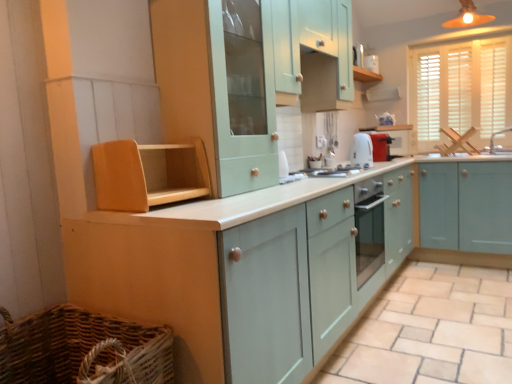
Where is `vacant space to the right of wooden shelf at left, the first cabinetry viewed from the left`? vacant space to the right of wooden shelf at left, the first cabinetry viewed from the left is located at coordinates (236, 205).